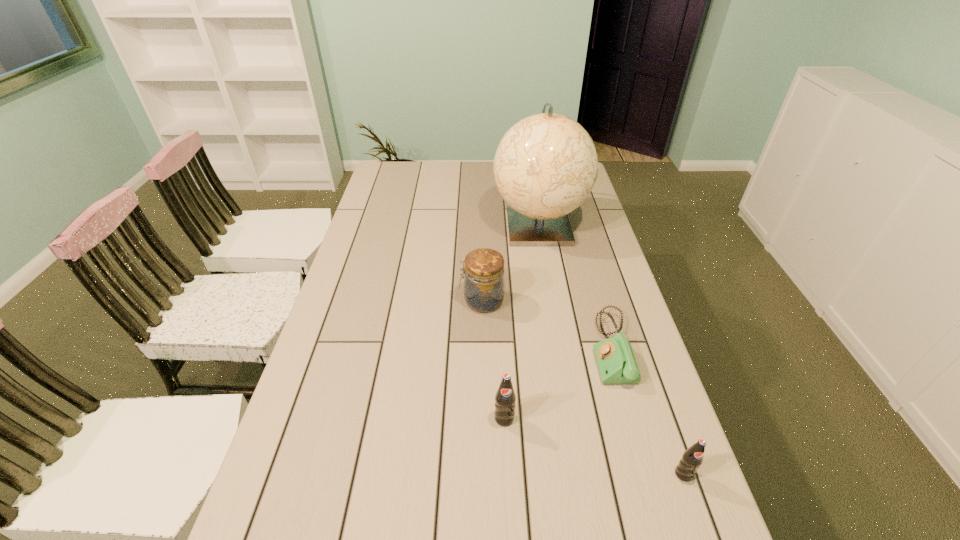
Find the location of a particular element. Image resolution: width=960 pixels, height=540 pixels. free space between the taller pop and the jar is located at coordinates (493, 360).

Identify the location of empty space that is in between the nearest object and the jar. (583, 388).

I want to click on object that is the second closest one to the shorter pop, so click(505, 398).

The width and height of the screenshot is (960, 540). Find the location of `object that stands as the fourth closest to the rightmost object`. object that stands as the fourth closest to the rightmost object is located at coordinates [546, 165].

You are a GUI agent. You are given a task and a screenshot of the screen. Output one action in this format:
    pyautogui.click(x=<x>, y=<y>)
    Task: Click on the blank space that satisfies the following two spatial constraints: 1. on the dial of the telephone; 2. on the front label of the taller pop
    The width and height of the screenshot is (960, 540).
    Given the screenshot: What is the action you would take?
    pyautogui.click(x=632, y=418)